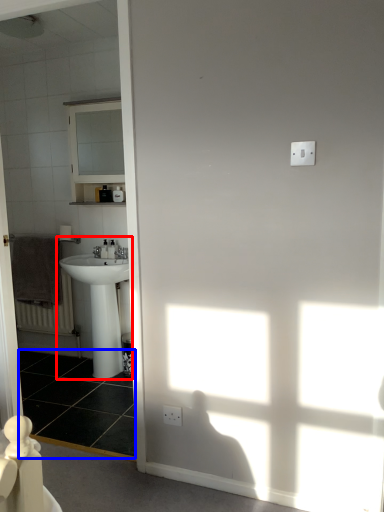
Question: Which object is further to the camera taking this photo, sink (highlighted by a red box) or tile (highlighted by a blue box)?

Choices:
 (A) sink
 (B) tile

Answer: (A)